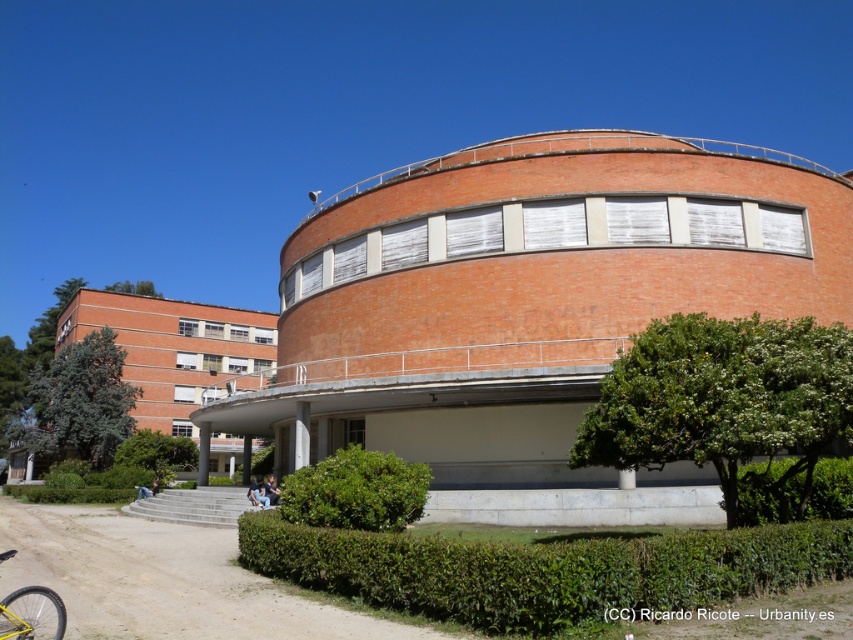
You are a landscape architect designing a garden path between the green leafy hedge at lower right and the yellow matte bicycle at lower left. Which side should the path be wider on?

The path should be wider on the side of the green leafy hedge at lower right because its width surpasses that of the yellow matte bicycle at lower left.

You are a photographer standing in front of the building. You notice the green leafy bush at lower center and the light blue jeans at lower center. Which object is positioned higher from the ground?

The green leafy bush at lower center is located above the light blue jeans at lower center, so it is positioned higher from the ground.